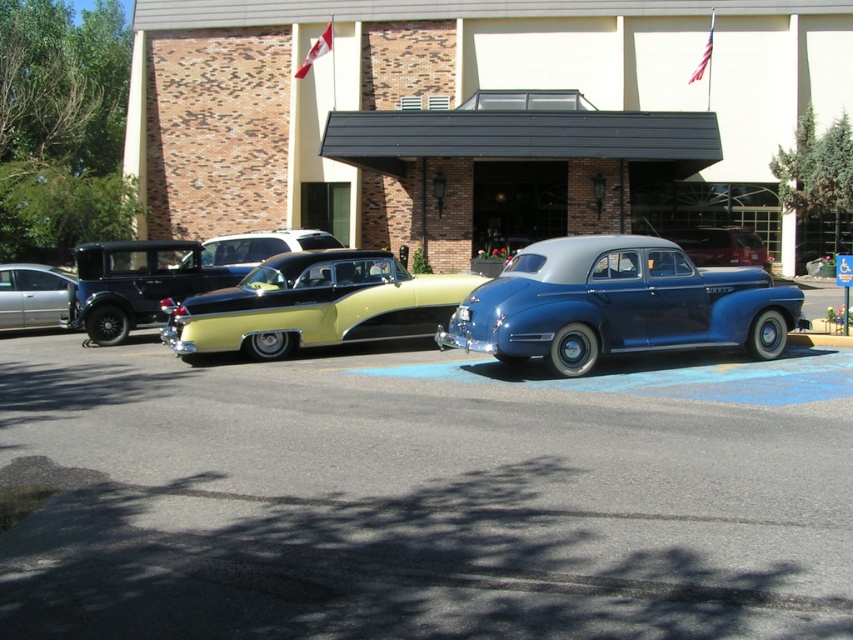
Question: Does smooth asphalt parking lot at center have a smaller size compared to yellow matte car at center?

Choices:
 (A) yes
 (B) no

Answer: (A)

Question: Based on their relative distances, which object is farther from the yellow glossy car at center?

Choices:
 (A) shiny blue sedan at center
 (B) silver metallic sedan at left
 (C) smooth asphalt parking lot at center
 (D) yellow matte car at center

Answer: (A)

Question: Where is silver metallic sedan at left located in relation to shiny blue sedan at center in the image?

Choices:
 (A) below
 (B) above

Answer: (A)

Question: Estimate the real-world distances between objects in this image. Which object is closer to the yellow matte car at center?

Choices:
 (A) smooth asphalt parking lot at center
 (B) metallic yellow car at center

Answer: (B)

Question: Estimate the real-world distances between objects in this image. Which object is closer to the metallic yellow car at center?

Choices:
 (A) glossy blue sedan at center
 (B) shiny blue sedan at center
 (C) yellow glossy car at center
 (D) silver metallic sedan at left

Answer: (A)

Question: Where is yellow matte car at center located in relation to shiny blue sedan at center in the image?

Choices:
 (A) right
 (B) left

Answer: (B)